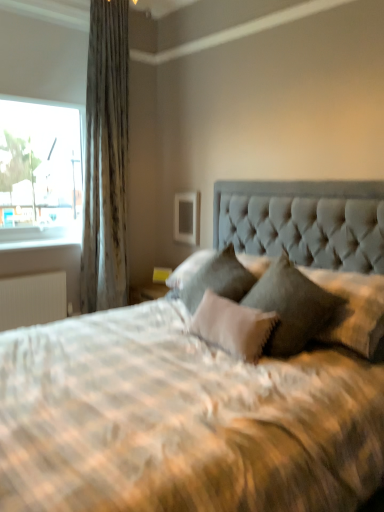
Question: Considering the relative positions of velvet gray pillow at center, the 3th pillow in the right-to-left sequence, and satin fabric curtain at left in the image provided, is velvet gray pillow at center, the 3th pillow in the right-to-left sequence, to the right of satin fabric curtain at left from the viewer's perspective?

Choices:
 (A) yes
 (B) no

Answer: (A)

Question: Considering the relative sizes of velvet gray pillow at center, the 3th pillow in the right-to-left sequence, and satin fabric curtain at left in the image provided, is velvet gray pillow at center, the 3th pillow in the right-to-left sequence, smaller than satin fabric curtain at left?

Choices:
 (A) no
 (B) yes

Answer: (B)

Question: Is velvet gray pillow at center, the 1th pillow from the left, further to camera compared to satin fabric curtain at left?

Choices:
 (A) yes
 (B) no

Answer: (B)

Question: From the image's perspective, is velvet gray pillow at center, the 3th pillow in the right-to-left sequence, on satin fabric curtain at left?

Choices:
 (A) yes
 (B) no

Answer: (B)

Question: From the image's perspective, is velvet gray pillow at center, the 3th pillow in the right-to-left sequence, under satin fabric curtain at left?

Choices:
 (A) yes
 (B) no

Answer: (A)

Question: From a real-world perspective, is satin fabric curtain at left positioned above or below velvet gray pillow at center, placed as the 1th pillow when sorted from right to left?

Choices:
 (A) below
 (B) above

Answer: (B)

Question: From the image's perspective, is satin fabric curtain at left positioned above or below velvet gray pillow at center, placed as the 1th pillow when sorted from right to left?

Choices:
 (A) above
 (B) below

Answer: (A)

Question: Considering the positions of point (117, 79) and point (374, 285), is point (117, 79) closer or farther from the camera than point (374, 285)?

Choices:
 (A) farther
 (B) closer

Answer: (A)

Question: Do you think satin fabric curtain at left is within velvet gray pillow at center, placed as the 1th pillow when sorted from right to left, or outside of it?

Choices:
 (A) outside
 (B) inside

Answer: (A)

Question: Does point (205, 263) appear closer or farther from the camera than point (324, 286)?

Choices:
 (A) farther
 (B) closer

Answer: (A)

Question: Based on their positions, is velvet gray pillow at center, the 1th pillow from the left, located to the left or right of velvet gray pillow at center, placed as the 1th pillow when sorted from right to left?

Choices:
 (A) right
 (B) left

Answer: (B)

Question: In the image, is velvet gray pillow at center, the 1th pillow from the left, positioned in front of or behind velvet gray pillow at center, placed as the 1th pillow when sorted from right to left?

Choices:
 (A) behind
 (B) front

Answer: (A)

Question: In terms of width, does velvet gray pillow at center, the 1th pillow from the left, look wider or thinner when compared to velvet gray pillow at center, which ranks as the third pillow in left-to-right order?

Choices:
 (A) wide
 (B) thin

Answer: (B)

Question: Does point (39, 238) appear closer or farther from the camera than point (337, 312)?

Choices:
 (A) closer
 (B) farther

Answer: (B)

Question: Is white plastic window sill at left spatially inside velvet gray pillow at center, placed as the 1th pillow when sorted from right to left, or outside of it?

Choices:
 (A) outside
 (B) inside

Answer: (A)